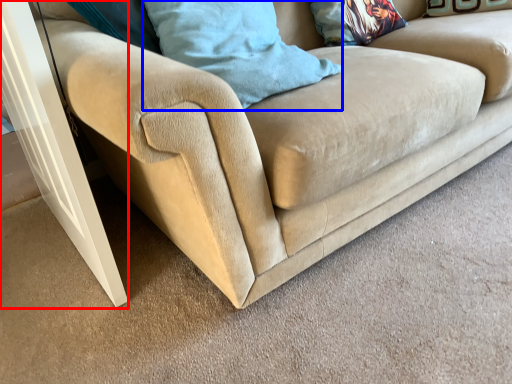
Question: Which object appears farthest to the camera in this image, screen door (highlighted by a red box) or pillow (highlighted by a blue box)?

Choices:
 (A) screen door
 (B) pillow

Answer: (B)